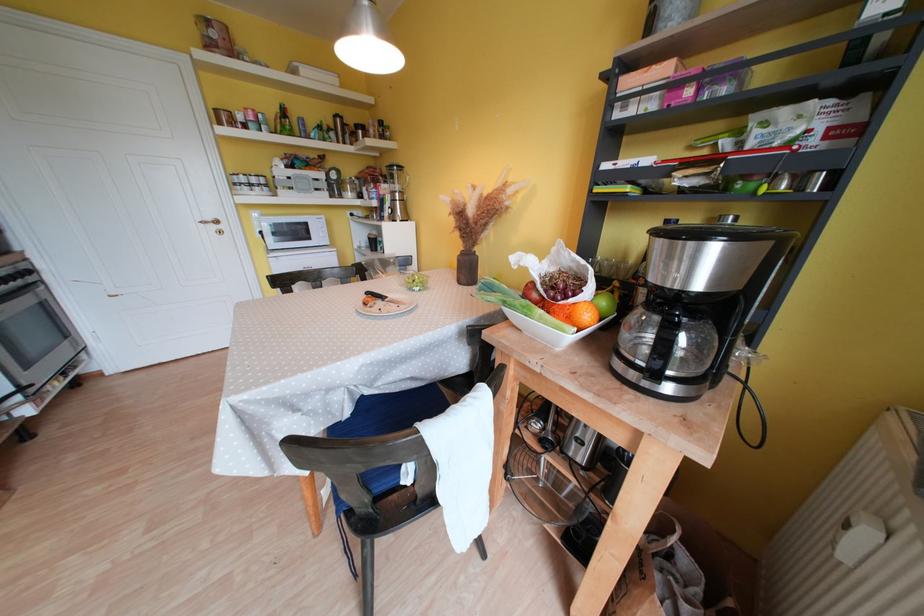
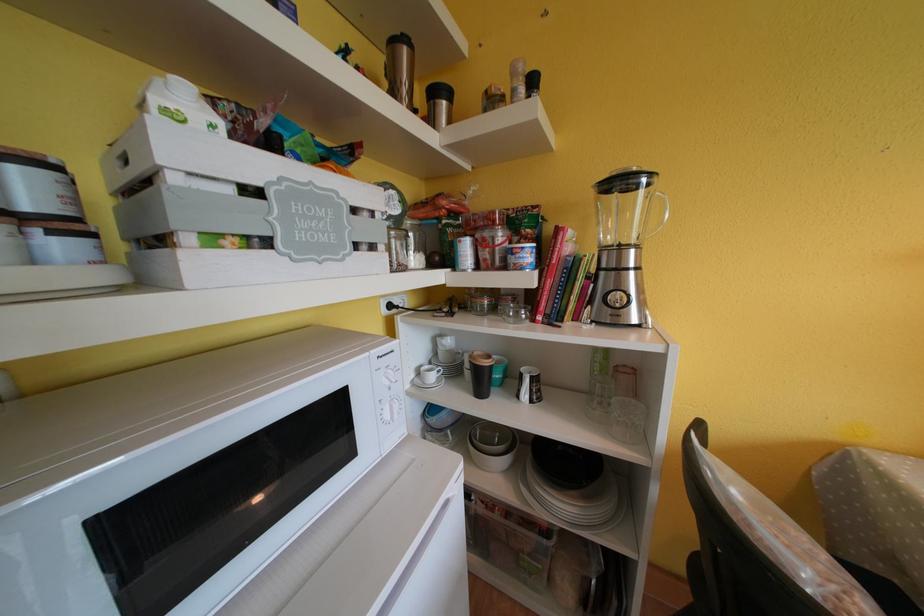
Locate, in the second image, the point that corresponds to pixel 362 130 in the first image.

(440, 95)